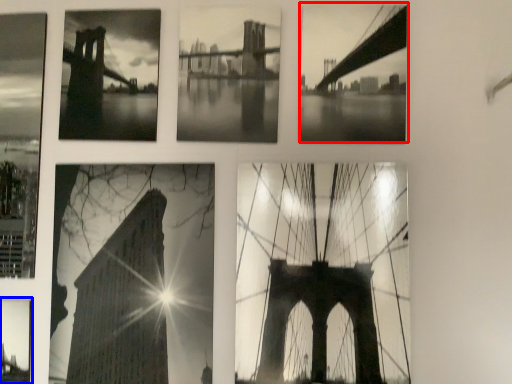
Question: Which object appears farthest to the camera in this image, picture frame (highlighted by a red box) or picture frame (highlighted by a blue box)?

Choices:
 (A) picture frame
 (B) picture frame

Answer: (B)